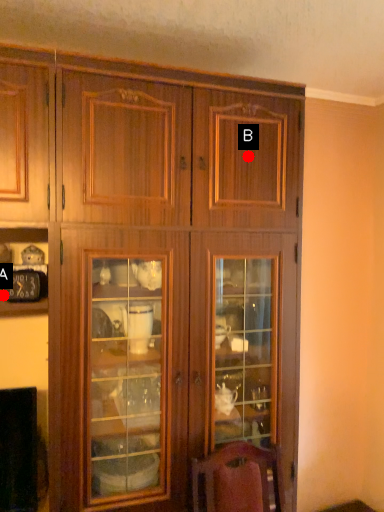
Question: Two points are circled on the image, labeled by A and B beside each circle. Which point appears farthest from the camera in this image?

Choices:
 (A) A is further
 (B) B is further

Answer: (B)